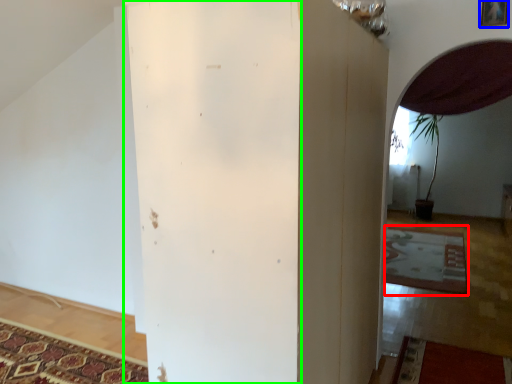
Question: Which object is the farthest from mat (highlighted by a red box)? Choose among these: picture frame (highlighted by a blue box) or pillar (highlighted by a green box).

Choices:
 (A) picture frame
 (B) pillar

Answer: (B)